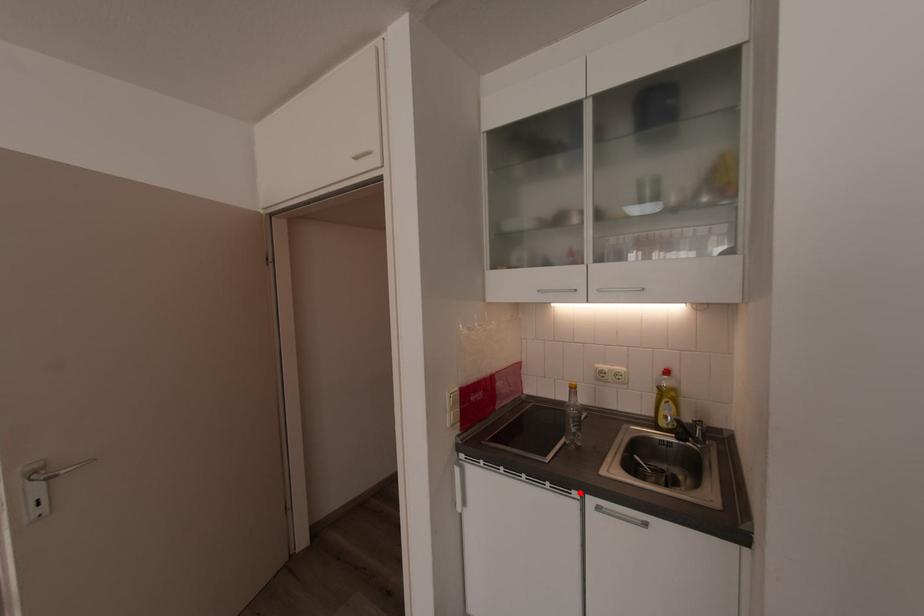
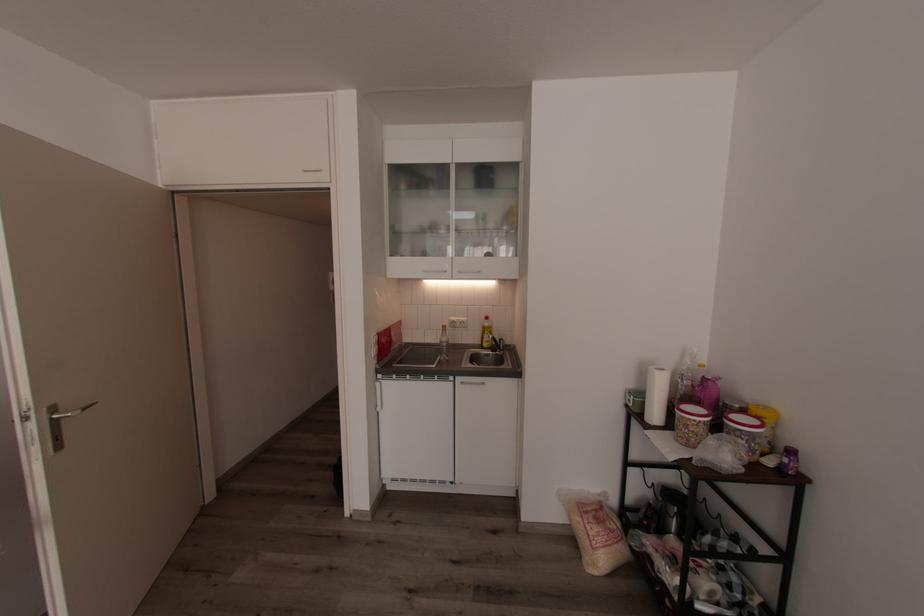
Find the pixel in the second image that matches the highlighted location in the first image.

(456, 378)